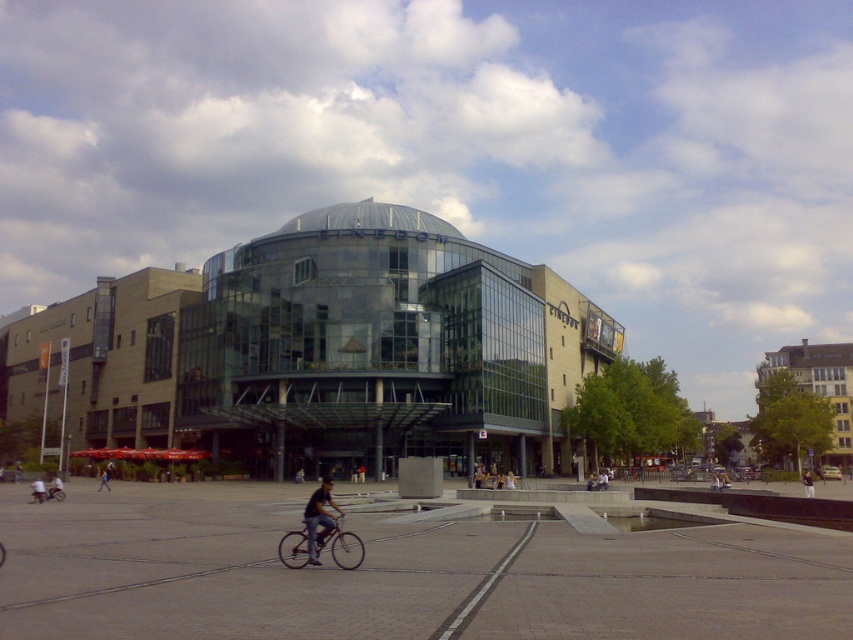
Question: Which point is closer to the camera taking this photo?

Choices:
 (A) (326, 490)
 (B) (105, 474)

Answer: (A)

Question: Can you confirm if metallic silver bicycle at lower left is smaller than dark blue jeans at lower left?

Choices:
 (A) no
 (B) yes

Answer: (B)

Question: Can you confirm if metallic silver bicycle at lower left is wider than brown leather jacket at center?

Choices:
 (A) no
 (B) yes

Answer: (A)

Question: Which of the following is the closest to the observer?

Choices:
 (A) metallic silver bicycle at lower left
 (B) light blue jeans at center
 (C) brown leather jacket at center

Answer: (A)

Question: Estimate the real-world distances between objects in this image. Which object is farther from the metallic silver bicycle at lower left?

Choices:
 (A) dark blue jeans at center
 (B) light blue jeans at center
 (C) brown leather jacket at center
 (D) metallic silver bicycle at center

Answer: (C)

Question: Is the position of denim pants at lower left more distant than that of brown leather jacket at center?

Choices:
 (A) yes
 (B) no

Answer: (B)